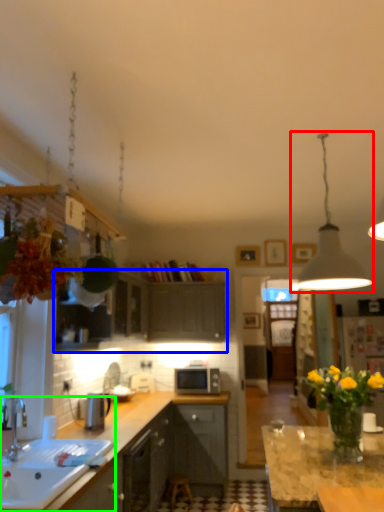
Question: Based on their relative distances, which object is nearer to light fixture (highlighted by a red box)? Choose from cabinetry (highlighted by a blue box) and sink (highlighted by a green box).

Choices:
 (A) cabinetry
 (B) sink

Answer: (B)